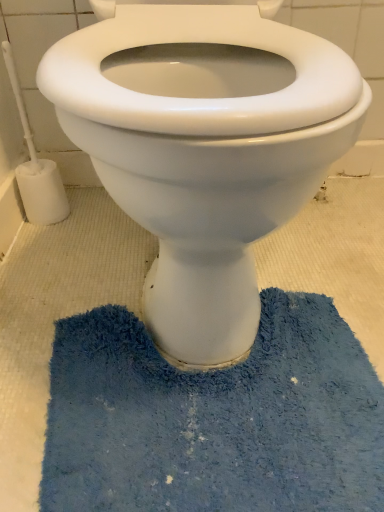
Identify the location of blank space situated above blue shaggy bath mat at lower center (from a real-world perspective). This screenshot has height=512, width=384. (214, 396).